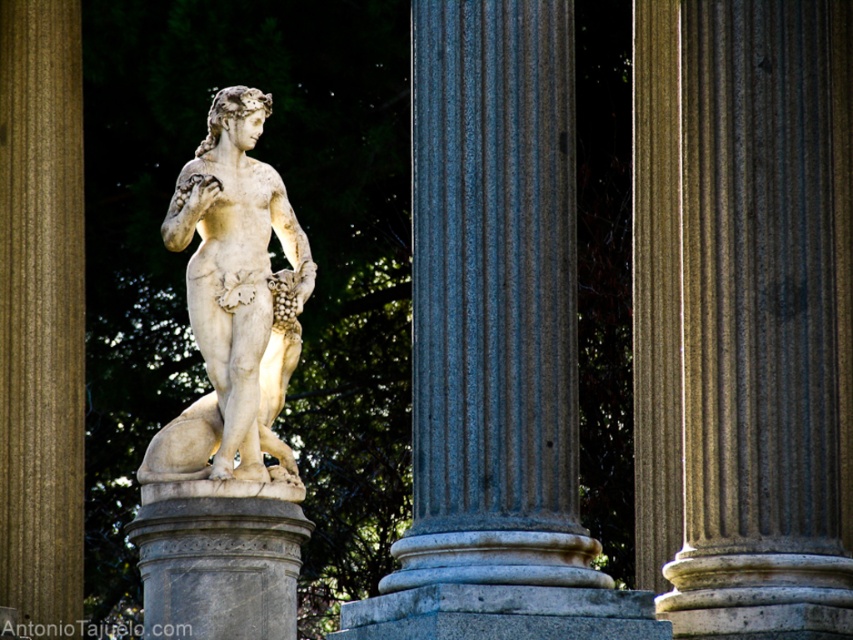
Question: Is smooth beige column at center to the left of white marble column at center from the viewer's perspective?

Choices:
 (A) no
 (B) yes

Answer: (A)

Question: Does smooth beige column at center lie behind gray marble column at center?

Choices:
 (A) yes
 (B) no

Answer: (A)

Question: Among these points, which one is nearest to the camera?

Choices:
 (A) (196, 598)
 (B) (815, 381)

Answer: (B)

Question: Is smooth gray column at center thinner than white marble statue at center?

Choices:
 (A) yes
 (B) no

Answer: (A)

Question: Which of the following is the farthest from the observer?

Choices:
 (A) smooth beige column at center
 (B) white marble statue at center
 (C) smooth gray column at center
 (D) white marble column at center

Answer: (C)

Question: Which point appears closest to the camera in this image?

Choices:
 (A) (663, 496)
 (B) (200, 228)
 (C) (3, 608)

Answer: (A)